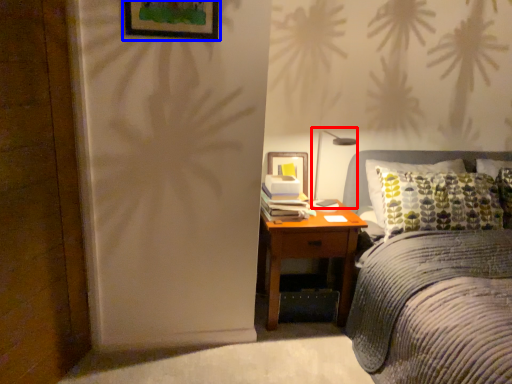
Question: Which point is closer to the camera, bedside lamp (highlighted by a red box) or picture frame (highlighted by a blue box)?

Choices:
 (A) bedside lamp
 (B) picture frame

Answer: (B)